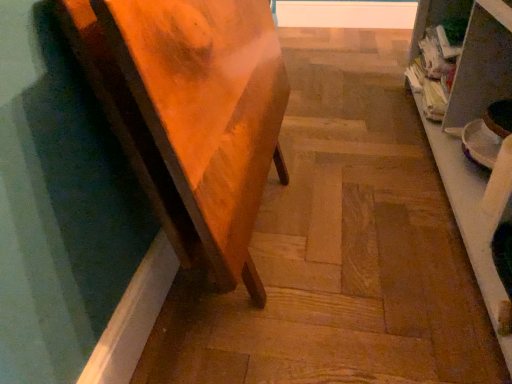
I want to click on vacant space situated on the left part of white glossy shelf at right, so click(355, 184).